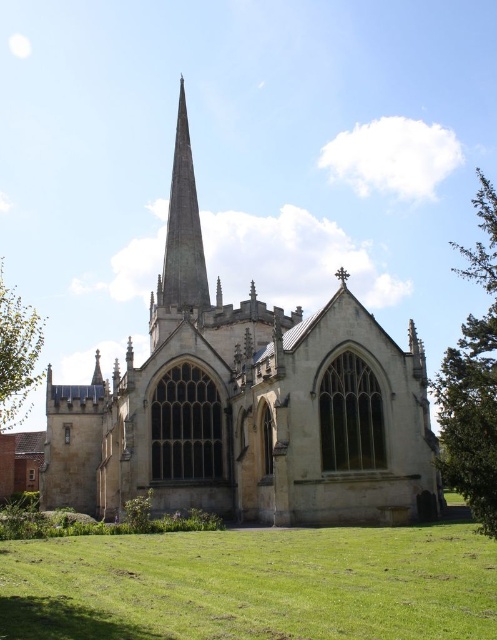
Between yellow stone church at center and green leafy tree at lower left, which one has less height?

green leafy tree at lower left

Does yellow stone church at center have a lesser width compared to green leafy tree at lower left?

In fact, yellow stone church at center might be wider than green leafy tree at lower left.

Find the location of a particular element. This screenshot has width=497, height=640. yellow stone church at center is located at coordinates (246, 404).

Does green copper spire at center appear on the right side of green leafy tree at lower left?

Correct, you'll find green copper spire at center to the right of green leafy tree at lower left.

Does point (175, 180) come behind point (29, 340)?

Yes, it is behind point (29, 340).

The height and width of the screenshot is (640, 497). What do you see at coordinates (182, 227) in the screenshot? I see `green copper spire at center` at bounding box center [182, 227].

The height and width of the screenshot is (640, 497). In order to click on green copper spire at center in this screenshot , I will do `click(182, 227)`.

Locate an element on the screen. yellow stone church at center is located at coordinates (246, 404).

The image size is (497, 640). I want to click on yellow stone church at center, so click(x=246, y=404).

The width and height of the screenshot is (497, 640). In order to click on yellow stone church at center in this screenshot , I will do `click(246, 404)`.